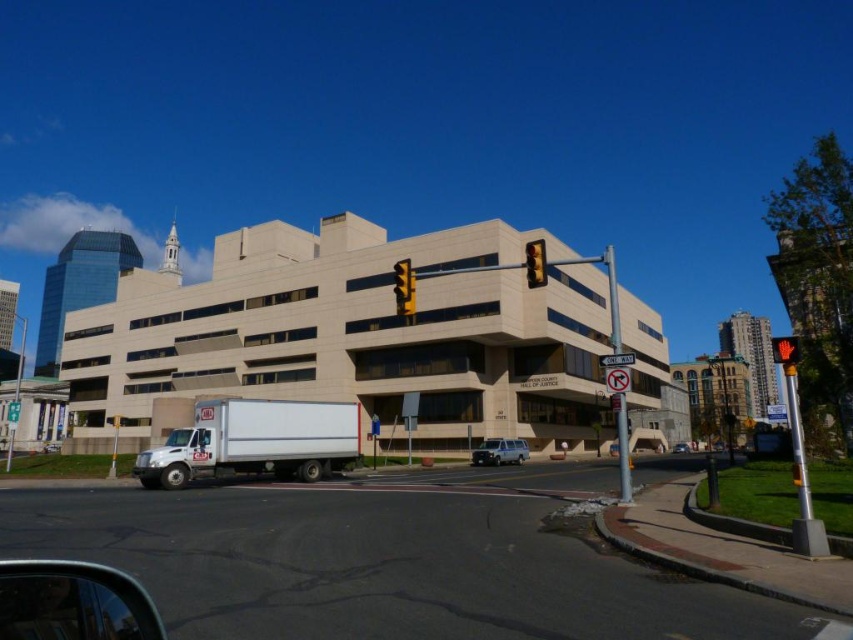
Between point (538, 276) and point (676, 451), which one is positioned behind?

Positioned behind is point (676, 451).

Is point (532, 276) closer to viewer compared to point (689, 445)?

Yes, it is in front of point (689, 445).

This screenshot has height=640, width=853. Describe the element at coordinates (535, 262) in the screenshot. I see `metallic yellow traffic light at upper center` at that location.

This screenshot has height=640, width=853. Find the location of `metallic yellow traffic light at upper center`. metallic yellow traffic light at upper center is located at coordinates pos(535,262).

Is point (480, 452) farther from viewer compared to point (781, 360)?

Yes, it is.

Can you confirm if silver metallic van at center is taller than red glass traffic light at upper right?

Incorrect, silver metallic van at center's height is not larger of red glass traffic light at upper right's.

Is point (479, 458) farther from camera compared to point (791, 364)?

Yes, point (479, 458) is behind point (791, 364).

In order to click on silver metallic van at center in this screenshot , I will do pos(498,451).

Consider the image. Between metallic yellow traffic light at upper center and red glass traffic light at upper right, which one is positioned lower?

Positioned lower is red glass traffic light at upper right.

Does metallic yellow traffic light at upper center have a smaller size compared to red glass traffic light at upper right?

Correct, metallic yellow traffic light at upper center occupies less space than red glass traffic light at upper right.

You are a GUI agent. You are given a task and a screenshot of the screen. Output one action in this format:
    pyautogui.click(x=<x>, y=<y>)
    Task: Click on the metallic yellow traffic light at upper center
    The height and width of the screenshot is (640, 853).
    Given the screenshot: What is the action you would take?
    pyautogui.click(x=535, y=262)

Find the location of a particular element. metallic yellow traffic light at upper center is located at coordinates (535, 262).